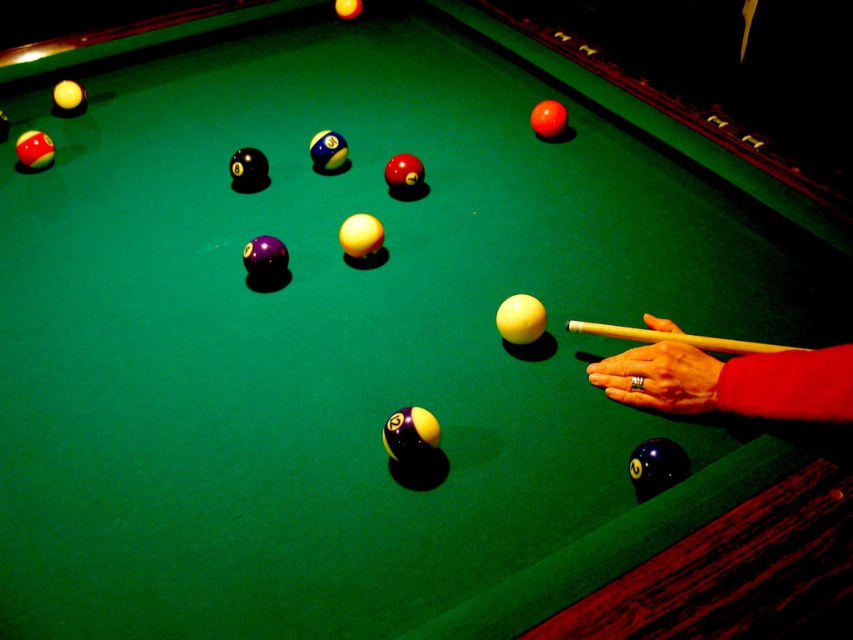
Question: Which point is farther to the camera?

Choices:
 (A) yellow wood cue at center
 (B) gold ring at lower right
 (C) smooth yellow cue stick at lower right

Answer: (B)

Question: Is gold ring at lower right above yellow wood cue at center?

Choices:
 (A) no
 (B) yes

Answer: (A)

Question: Which object is the closest to the yellow wood cue at center?

Choices:
 (A) smooth yellow cue stick at lower right
 (B) gold ring at lower right

Answer: (B)

Question: Is smooth yellow cue stick at lower right positioned in front of gold ring at lower right?

Choices:
 (A) yes
 (B) no

Answer: (A)

Question: Which point is closer to the camera?

Choices:
 (A) (759, 401)
 (B) (714, 348)
 (C) (669, 387)

Answer: (A)

Question: Can you confirm if gold ring at lower right is positioned to the left of yellow wood cue at center?

Choices:
 (A) no
 (B) yes

Answer: (B)